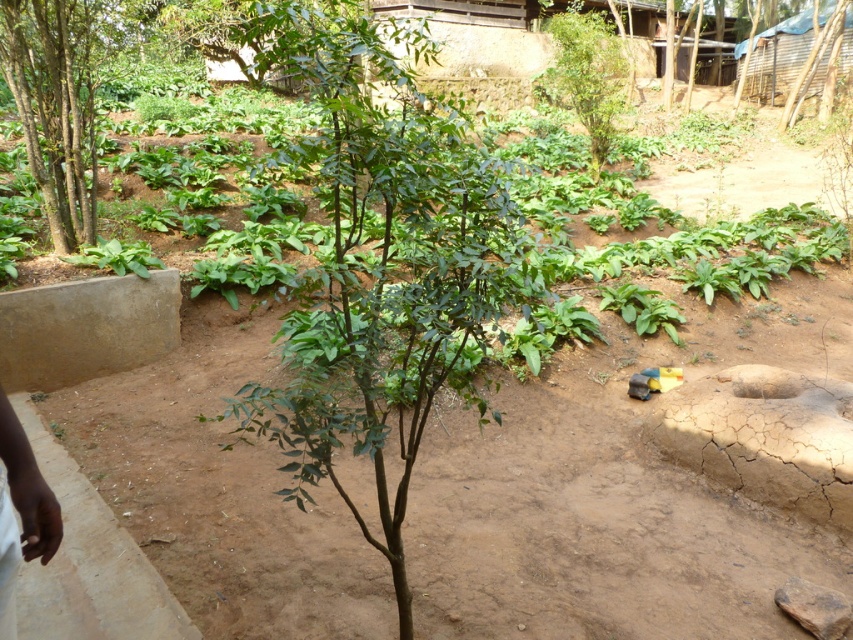
Question: Considering the relative positions of green leafy tree at center and green leafy tree at left in the image provided, where is green leafy tree at center located with respect to green leafy tree at left?

Choices:
 (A) right
 (B) left

Answer: (A)

Question: Is green leafy tree at center closer to the viewer compared to green leafy tree at left?

Choices:
 (A) yes
 (B) no

Answer: (B)

Question: Which point is farther from the camera taking this photo?

Choices:
 (A) (76, 140)
 (B) (616, 58)

Answer: (B)

Question: Which point is closer to the camera?

Choices:
 (A) green leafy tree at upper center
 (B) green leafy tree at center
 (C) green leafy tree at left

Answer: (C)

Question: Among these points, which one is farthest from the camera?

Choices:
 (A) (86, 132)
 (B) (590, 54)
 (C) (434, 344)

Answer: (B)

Question: Does green leafy tree at center appear on the left side of green leafy tree at left?

Choices:
 (A) no
 (B) yes

Answer: (A)